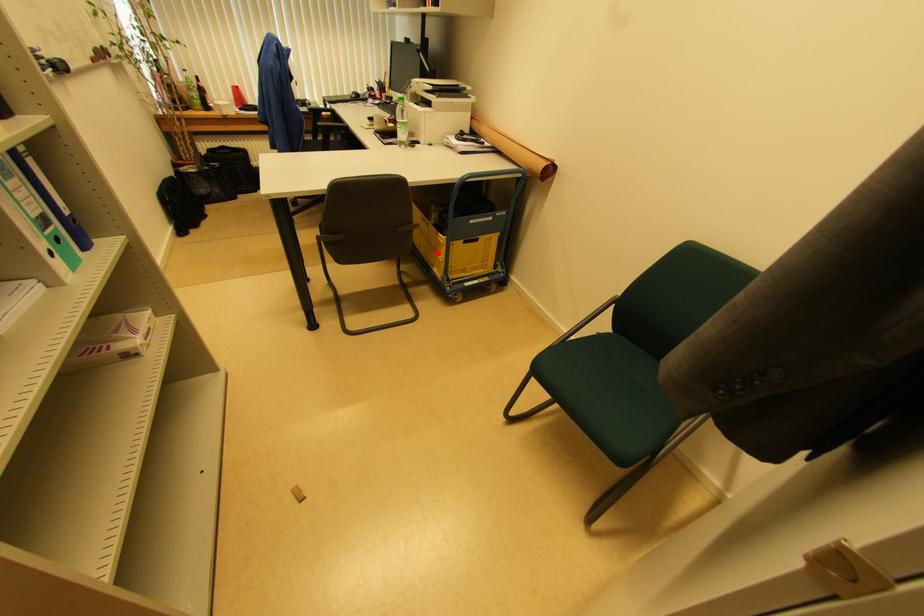
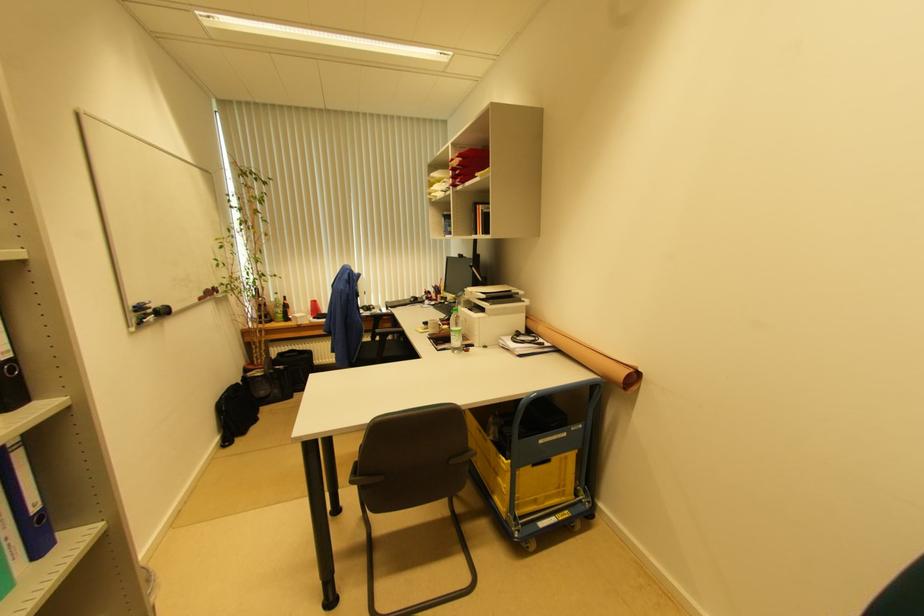
Question: I am providing you with two images of the same scene from different viewpoints. Given a red point in image1, look at the same physical point in image2. Is it:

Choices:
 (A) Closer to the viewpoint
 (B) Farther from the viewpoint

Answer: (B)